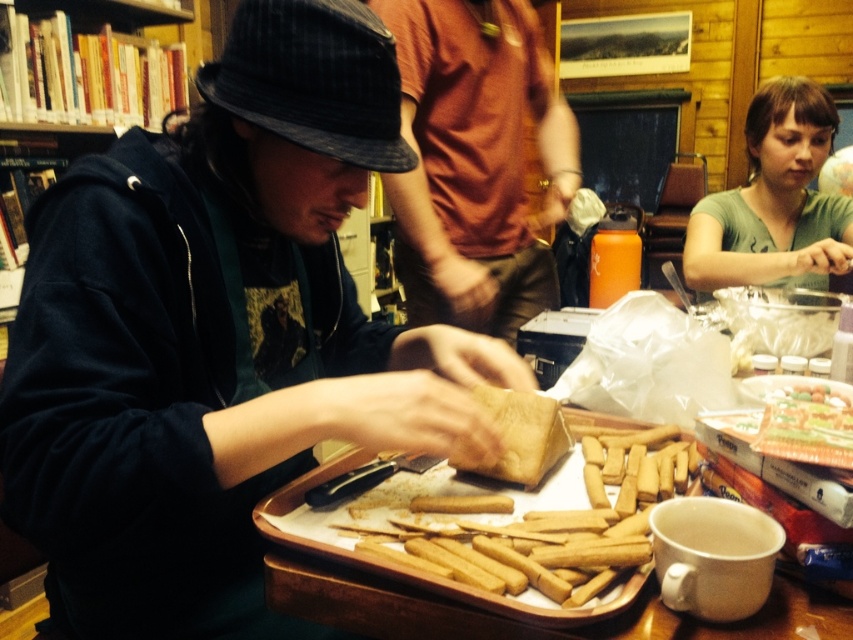
Looking at this image, you are organizing a craft fair and need to display two items from the scene. The matte black hat at center and the matte orange shirt at center must be placed side by side on a shelf. Based on their sizes, which item should be placed first to ensure they fit properly?

The matte black hat at center has a greater width than the matte orange shirt at center. Therefore, place the matte black hat at center first to accommodate its larger size, ensuring both items fit on the shelf.

You are a visitor in this room and want to take a photo of the matte orange shirt at center and the wooden tray at center. Which object should you focus on first to ensure both are in clear view?

You should focus on the matte orange shirt at center first because it is closer to you than the wooden tray at center, ensuring both are in focus when you adjust the camera accordingly.

You are a person with a 24 inch wide box that you need to place between the matte orange shirt at center and the wooden tray at center. Can you fit the box in that space?

The distance between the matte orange shirt at center and the wooden tray at center is 26.85 inches. Since the box is 24 inches wide, it can fit in the space between them as the distance is greater than the box width.